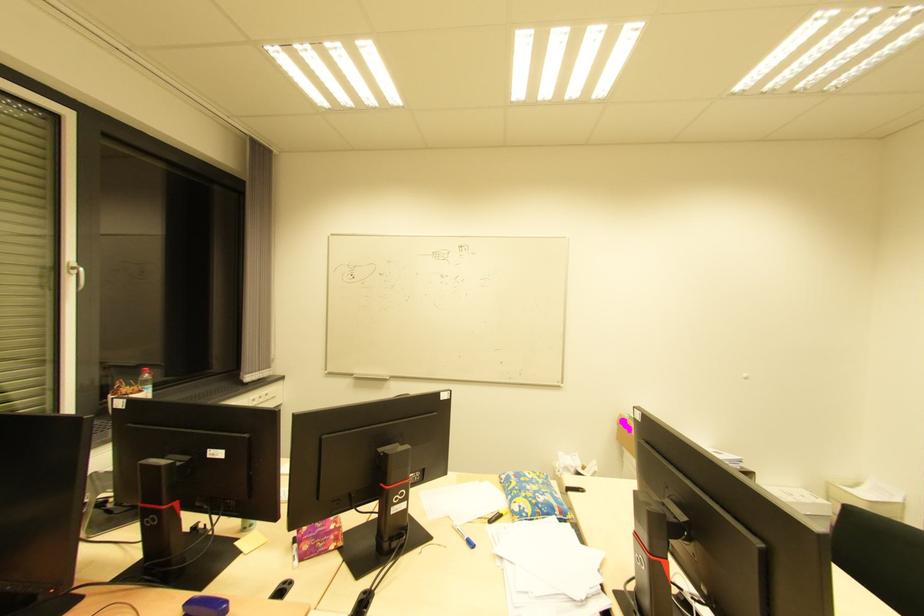
Where would you lift the purple tissue box? Please return your answer as a coordinate pair (x, y).

(317, 538)